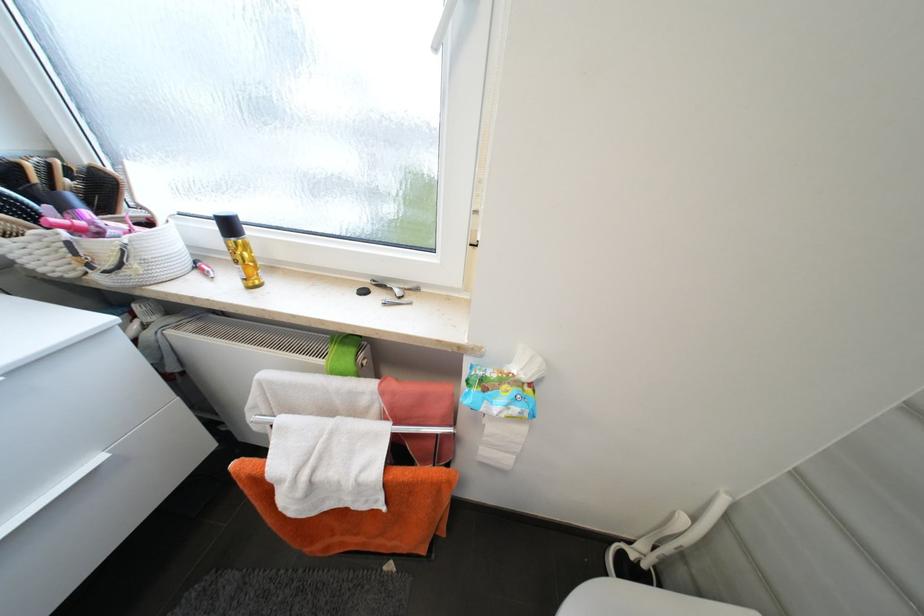
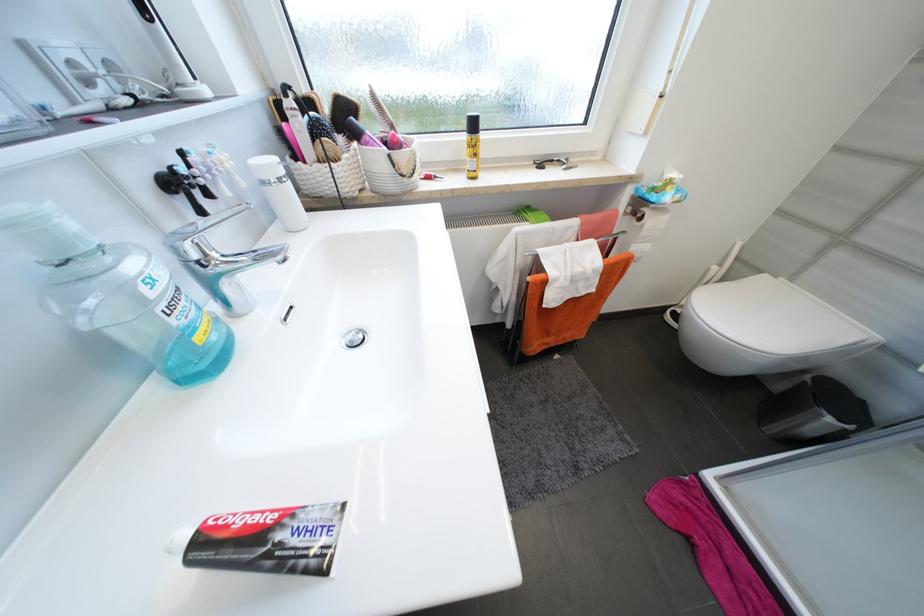
Question: In a continuous first-person perspective shot, in which direction is the camera moving?

Choices:
 (A) Left
 (B) Right
 (C) Forward
 (D) Backward

Answer: (A)